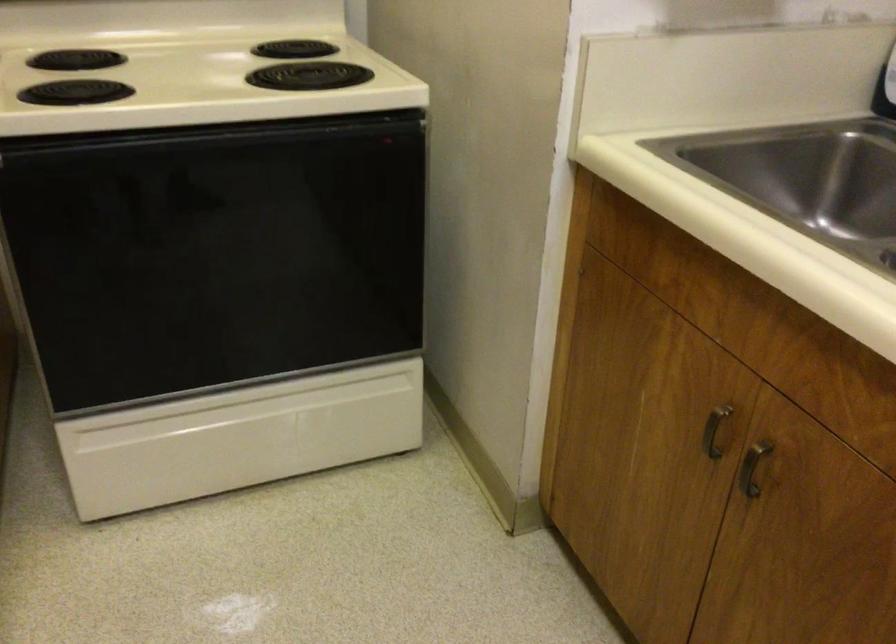
Locate an element on the screen. This screenshot has width=896, height=644. oven door handle is located at coordinates (213, 136).